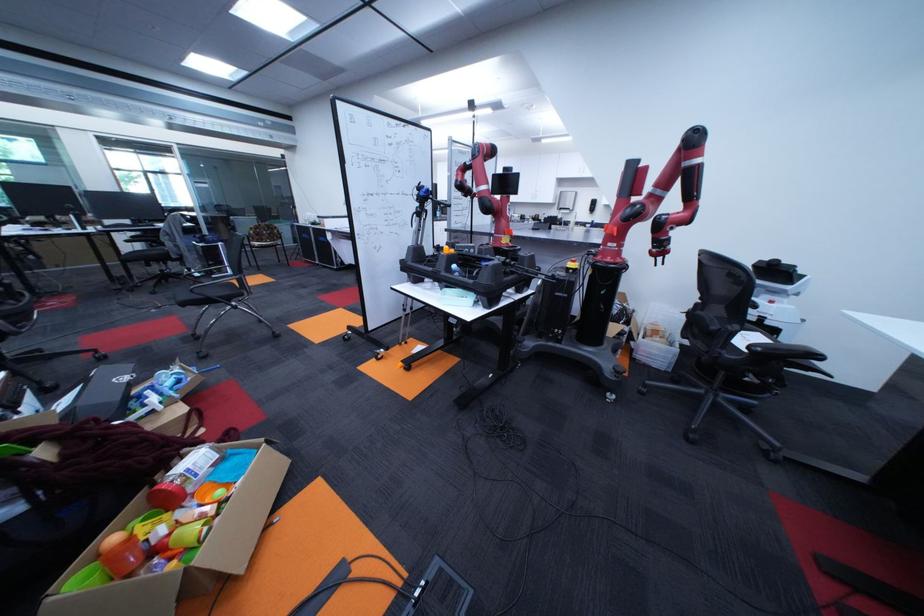
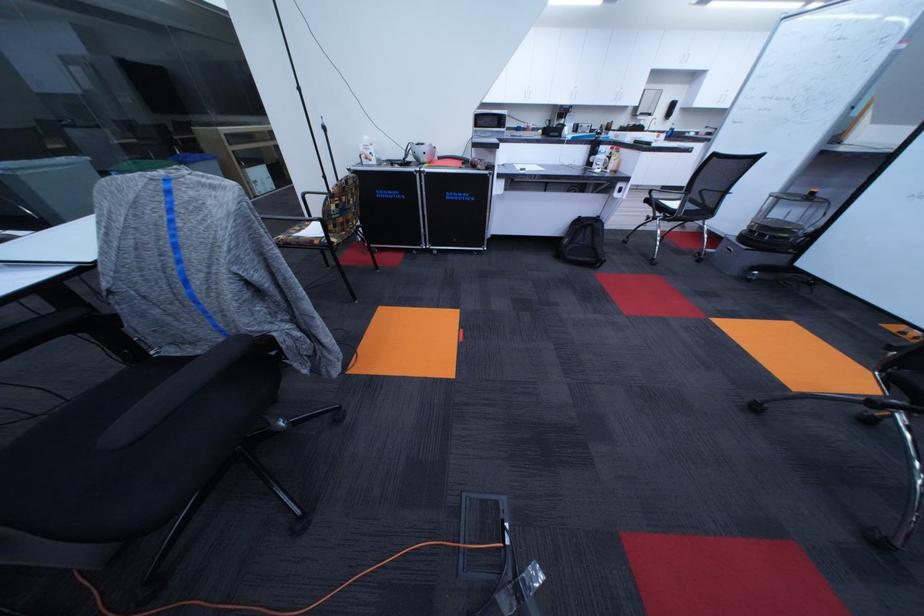
Find the pixel in the second image that matches (606,204) in the first image.

(686, 107)